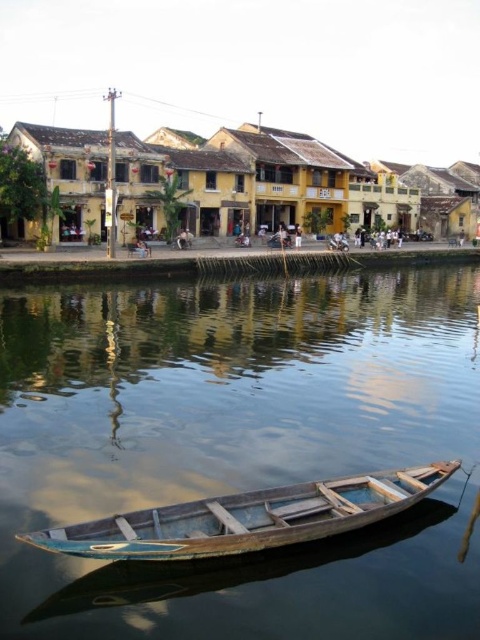
From the picture: Between smooth dark blue water at center and wooden boat at lower center, which one appears on the left side from the viewer's perspective?

From the viewer's perspective, smooth dark blue water at center appears more on the left side.

Who is taller, smooth dark blue water at center or wooden boat at lower center?

Standing taller between the two is smooth dark blue water at center.

At what (x,y) coordinates should I click in order to perform the action: click on smooth dark blue water at center. Please return your answer as a coordinate pair (x, y). The height and width of the screenshot is (640, 480). Looking at the image, I should click on (240, 449).